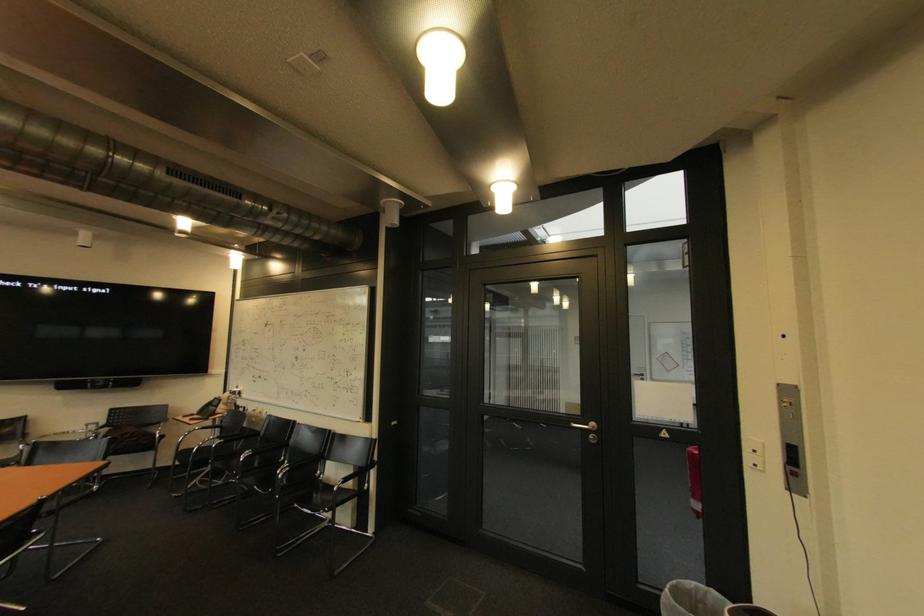
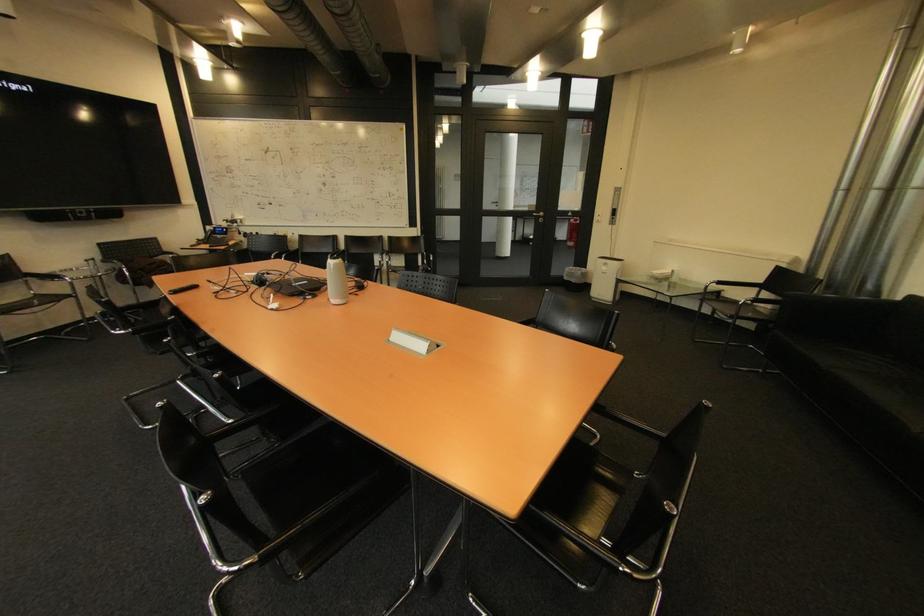
Where in the second image is the point corresponding to (x=586, y=413) from the first image?

(542, 209)